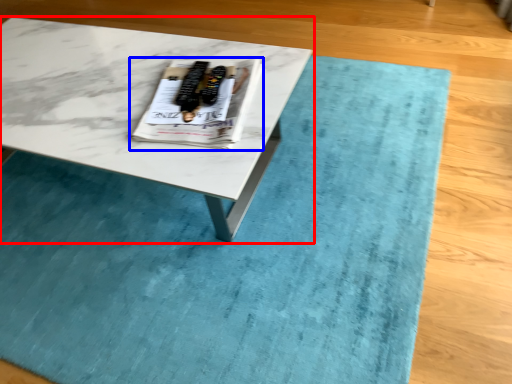
Question: Which object is closer to the camera taking this photo, coffee table (highlighted by a red box) or magazine (highlighted by a blue box)?

Choices:
 (A) coffee table
 (B) magazine

Answer: (A)